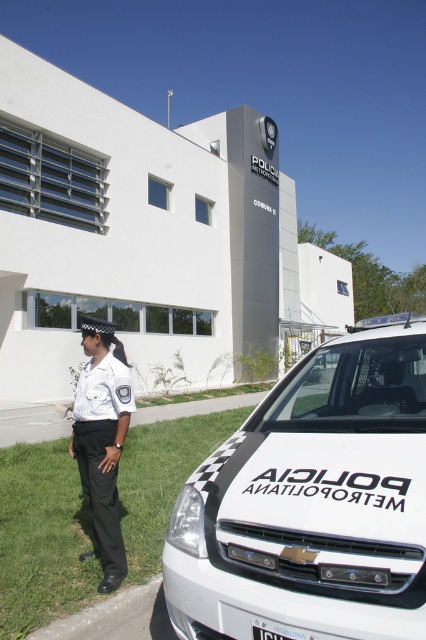
Measure the distance between white glossy van at lower right and camera.

The distance of white glossy van at lower right from camera is 5.98 feet.

Does white glossy van at lower right have a lesser height compared to white uniform at center?

Indeed, white glossy van at lower right has a lesser height compared to white uniform at center.

Between point (195, 474) and point (80, 392), which one is positioned in front?

Point (195, 474) is in front.

Where is `white glossy van at lower right`? white glossy van at lower right is located at coordinates (313, 502).